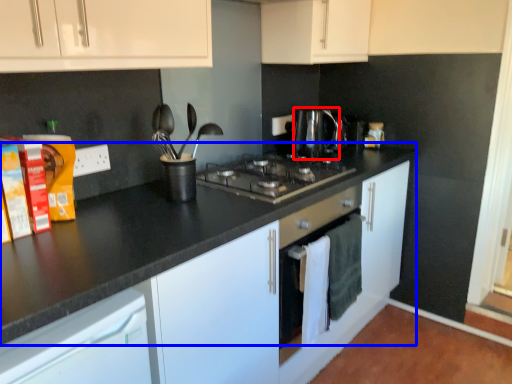
Question: Which of the following is the farthest to the observer, kitchen appliance (highlighted by a red box) or counter top (highlighted by a blue box)?

Choices:
 (A) kitchen appliance
 (B) counter top

Answer: (A)